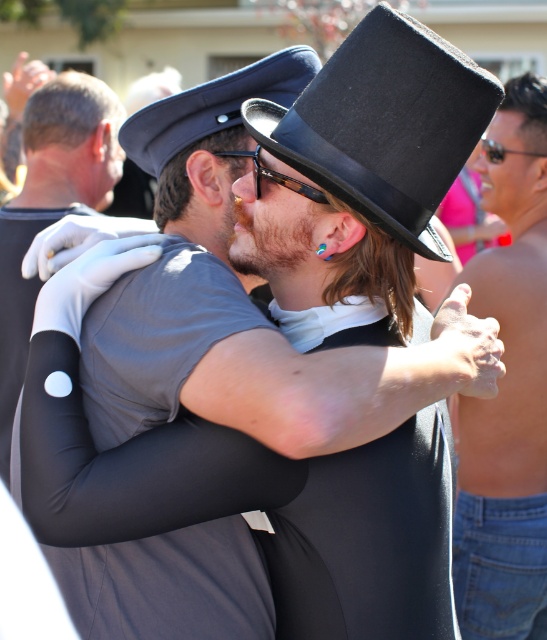
You are a photographer trying to capture the perfect shot of the shiny skin torso at right. Based on its coordinates, where should you aim your camera to ensure it is centered in the frame?

The shiny skin torso at right is located at coordinates point [508,388], so aim your camera at that point to center it in the frame.

You are a photographer trying to capture a clear shot of both the black leather dress hat at upper center and the blue fabric cap at upper center. Since you want both to be fully visible in the frame, which object should you adjust your focus on to ensure the other fits without cropping?

The black leather dress hat at upper center has a larger width than the blue fabric cap at upper center. To ensure both are fully visible without cropping, focus on the wider black leather dress hat at upper center as it requires more space.